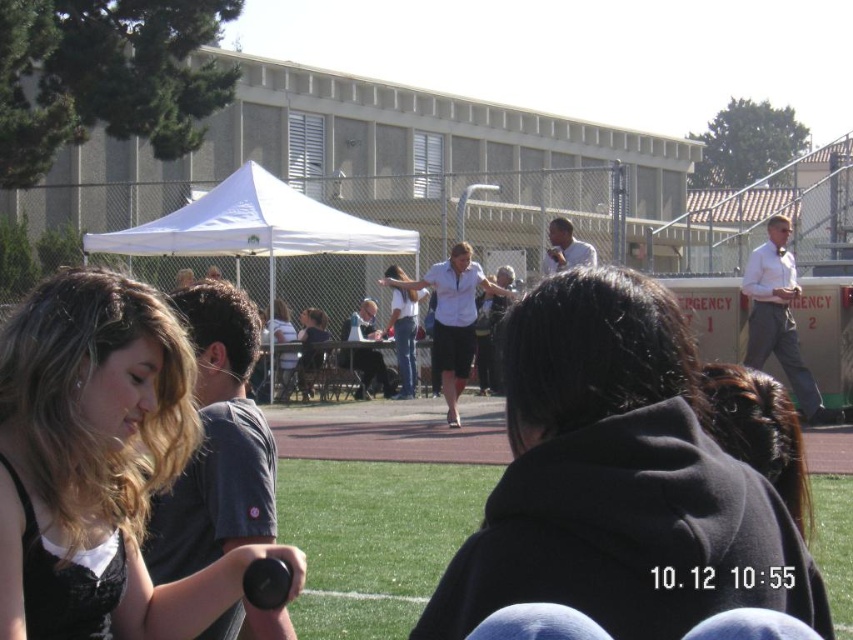
Can you confirm if green grass at center is positioned to the left of matte white shirt at center?

Incorrect, green grass at center is not on the left side of matte white shirt at center.

Based on the photo, does green grass at center appear under matte white shirt at center?

Indeed, green grass at center is positioned under matte white shirt at center.

From the picture: Who is more distant from viewer, (357, 628) or (280, 352)?

The point (280, 352) is more distant.

The width and height of the screenshot is (853, 640). In order to click on green grass at center in this screenshot , I will do `click(374, 538)`.

Who is lower down, white fabric canopy at center or matte white shirt at center?

matte white shirt at center is lower down.

Between white fabric canopy at center and matte white shirt at center, which one appears on the right side from the viewer's perspective?

Positioned to the right is white fabric canopy at center.

What do you see at coordinates (254, 225) in the screenshot? The width and height of the screenshot is (853, 640). I see `white fabric canopy at center` at bounding box center [254, 225].

Locate an element on the screen. This screenshot has width=853, height=640. white fabric canopy at center is located at coordinates (254, 225).

Does green grass at center appear on the right side of white fabric canopy at center?

Indeed, green grass at center is positioned on the right side of white fabric canopy at center.

Which of these two, green grass at center or white fabric canopy at center, stands taller?

With more height is white fabric canopy at center.

Which is behind, point (839, 560) or point (320, 227)?

Point (320, 227)

This screenshot has width=853, height=640. What are the coordinates of `green grass at center` in the screenshot? It's located at (374, 538).